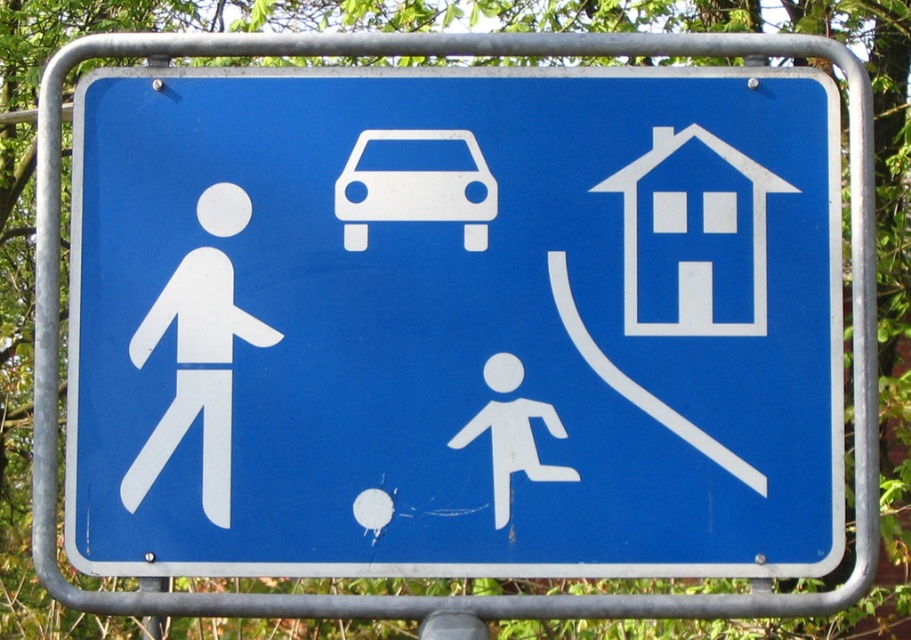
Identify the location of blue plastic sign at center. The width and height of the screenshot is (911, 640). (456, 324).

Does point (350, 81) come farther from viewer compared to point (227, 460)?

Yes, it is behind point (227, 460).

In order to click on blue plastic sign at center in this screenshot , I will do pyautogui.click(x=456, y=324).

Is blue plastic sign at center thinner than white matte car at center?

No, blue plastic sign at center is not thinner than white matte car at center.

Is blue plastic sign at center further to the viewer compared to white matte car at center?

No.

Measure the distance between blue plastic sign at center and camera.

A distance of 3.83 meters exists between blue plastic sign at center and camera.

Where is `blue plastic sign at center`? This screenshot has width=911, height=640. blue plastic sign at center is located at coordinates (x=456, y=324).

Can you confirm if white paper figure at left is positioned to the left of white matte car at center?

Correct, you'll find white paper figure at left to the left of white matte car at center.

Does point (150, 323) come farther from viewer compared to point (471, 163)?

No, it is not.

Locate an element on the screen. This screenshot has height=640, width=911. white paper figure at left is located at coordinates (195, 374).